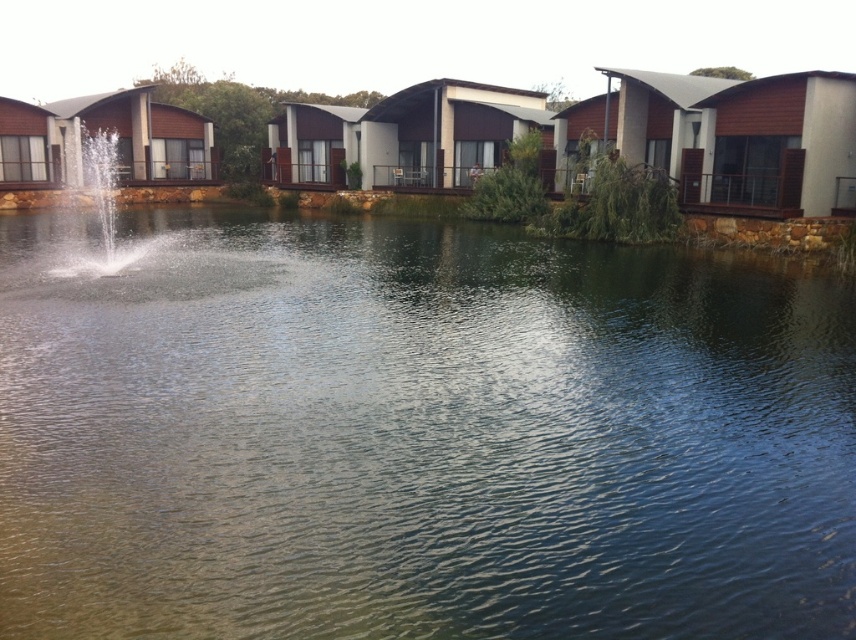
You are standing at the edge of the lake in the image and want to locate the point marked at coordinates (415, 435). According to the scene description, where would this point be located?

The point marked at coordinates (415, 435) is located on the clear water at center.

You are a guest staying at the resort and want to take a photo of the clear water at center and the clear water fountain at center from the balcony of your room. Which object will appear larger in the photo?

The clear water fountain at center will appear larger in the photo because it occupies more space than the clear water at center.

You are standing at the point marked as point [117,253] in the lakeside resort scene. You want to walk to the point marked as point [583,342]. Based on the scene description, which direction should you face to walk towards your destination?

You should face forward because point [583,342] is in front of point [117,253].